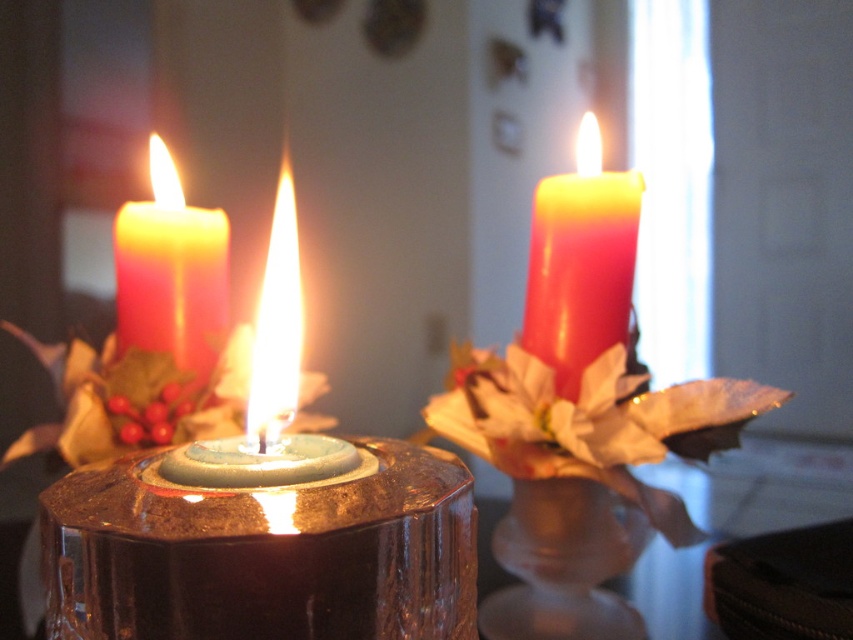
Question: Which object appears farthest from the camera in this image?

Choices:
 (A) matte red candle at right
 (B) matte red candle at left

Answer: (B)

Question: Is matte red candle at right smaller than matte red candle at left?

Choices:
 (A) no
 (B) yes

Answer: (B)

Question: Which point is closer to the camera taking this photo?

Choices:
 (A) (202, 342)
 (B) (374, 442)

Answer: (B)

Question: Is matte red candle at right wider than matte red candle at left?

Choices:
 (A) yes
 (B) no

Answer: (B)

Question: Which point appears farthest from the camera in this image?

Choices:
 (A) (155, 140)
 (B) (556, 220)

Answer: (A)

Question: Is glossy glass candle holder at center to the right of matte red candle at right from the viewer's perspective?

Choices:
 (A) yes
 (B) no

Answer: (B)